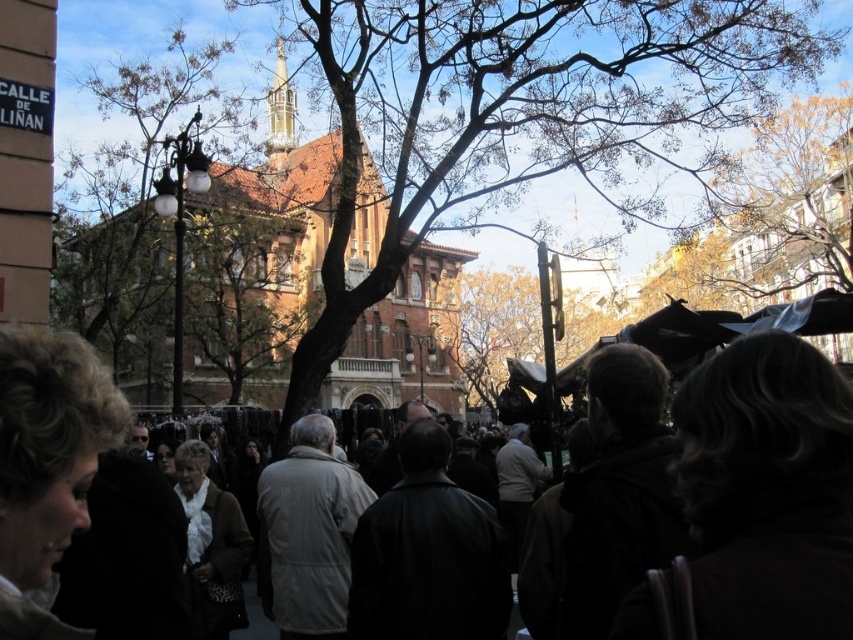
You are a photographer trying to capture a photo of the brown brick church at center and the beige fabric coat at center in the same frame. Since the camera can only focus on one object at a time, which object should you focus on first to ensure it appears larger in the photo?

The brown brick church at center is taller than the beige fabric coat at center, so you should focus on the brown brick church at center first to ensure it appears larger in the photo.

You are a photographer trying to capture the historic building with the red tiled roof in the background. You have two points marked on your viewfinder at coordinates point (549, 26) and point (485, 576). Which point should you focus on to ensure the historic building is clearly visible in your photo?

Point (549, 26) is behind point (485, 576), so focusing on point (485, 576) would allow the historic building with the red tiled roof to be clearly visible since it is in the foreground and closer to the camera.

You are standing in the urban scene and want to take a photo of the bare branches at center. Where should you aim your camera to capture them?

You should aim your camera at point (575, 106) to capture the bare branches at center.